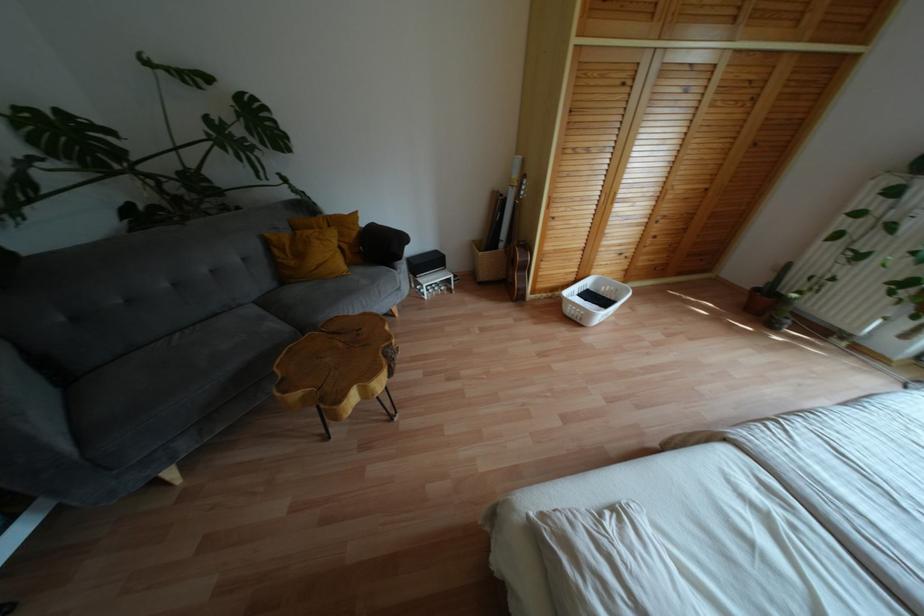
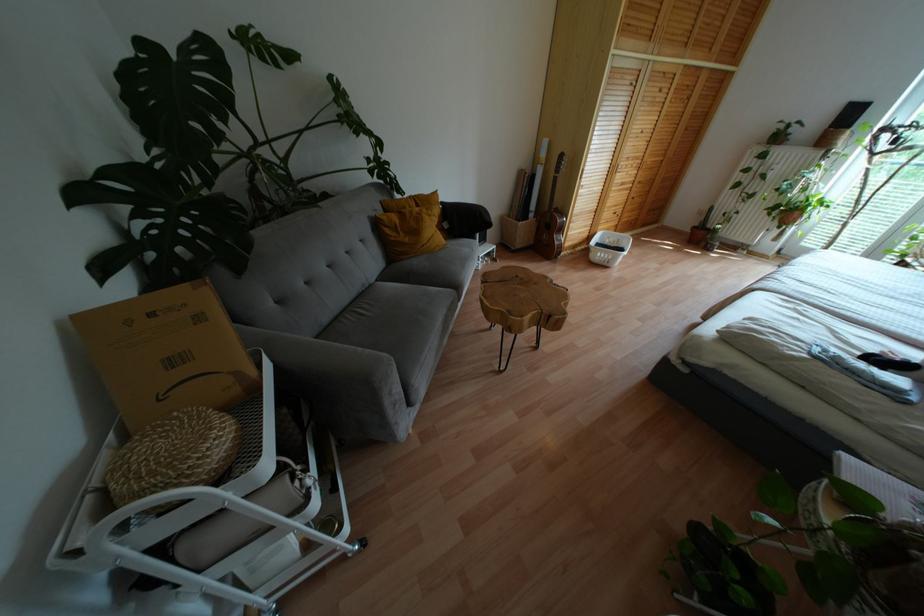
In the second image, find the point that corresponds to [757,290] in the first image.

(694, 227)